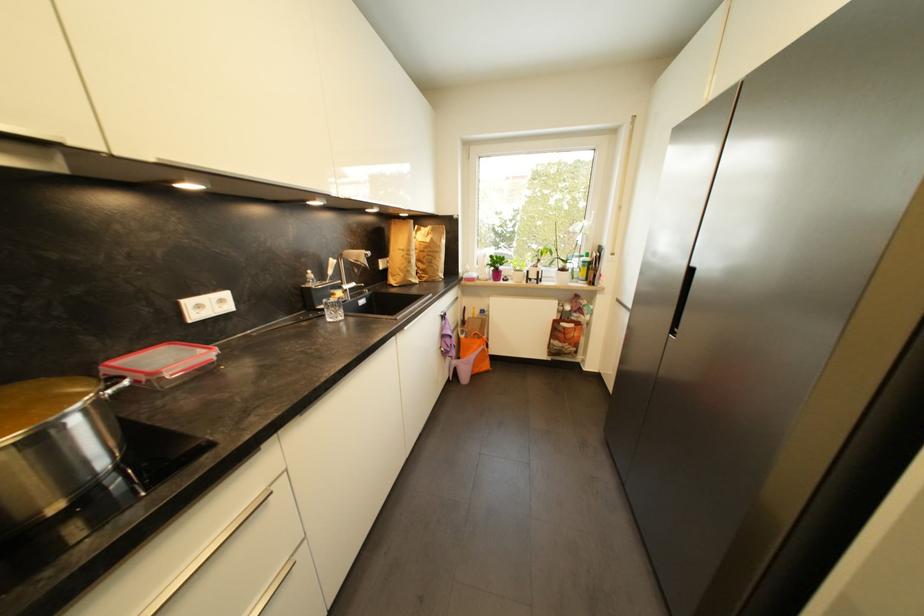
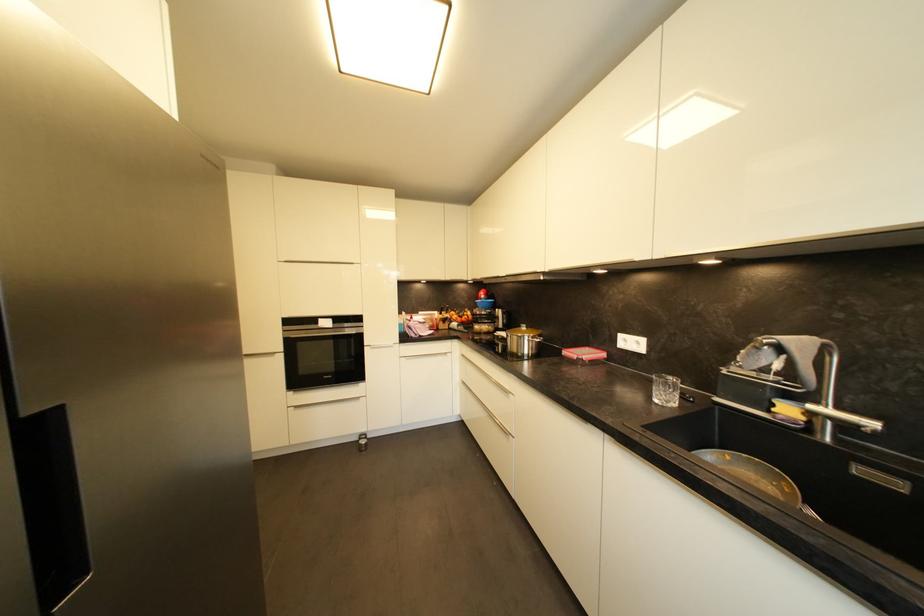
Find the pixel in the second image that matches [136,354] in the first image.

(602, 350)